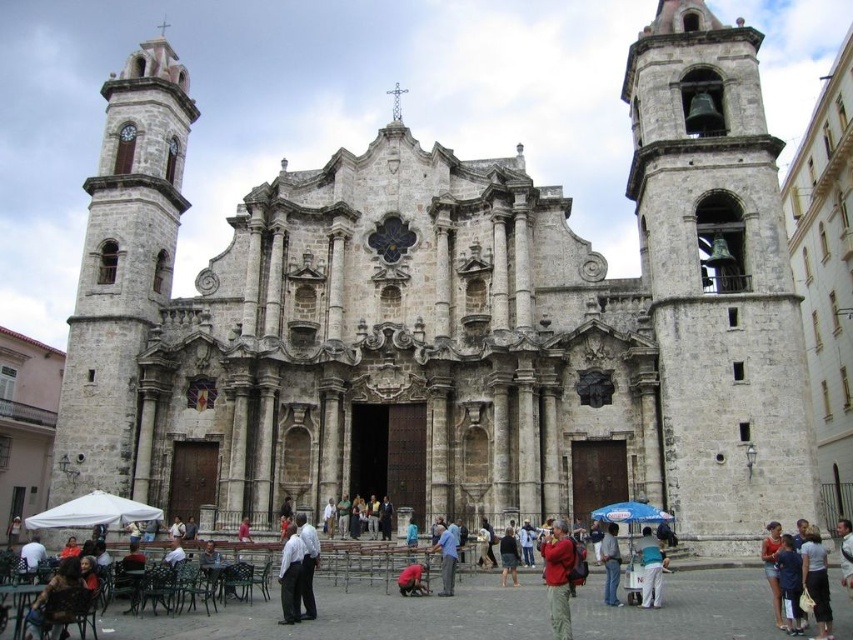
Question: Which point is closer to the camera?

Choices:
 (A) (305, 548)
 (B) (117, 496)

Answer: (A)

Question: Among these points, which one is farthest from the camera?

Choices:
 (A) (405, 576)
 (B) (608, 556)
 (C) (621, 518)
 (D) (561, 547)

Answer: (C)

Question: Does white shirt at center appear on the right side of white fabric shirt at center?

Choices:
 (A) no
 (B) yes

Answer: (A)

Question: Which point is closer to the camera?

Choices:
 (A) (778, 531)
 (B) (848, 544)
 (C) (361, 499)
 (D) (572, 556)

Answer: (D)

Question: Does dark blue shirt at center have a lesser width compared to denim shorts at lower right?

Choices:
 (A) no
 (B) yes

Answer: (B)

Question: Observing the image, what is the correct spatial positioning of white fabric umbrella at lower left in reference to dark gray suit at center?

Choices:
 (A) above
 (B) below

Answer: (B)